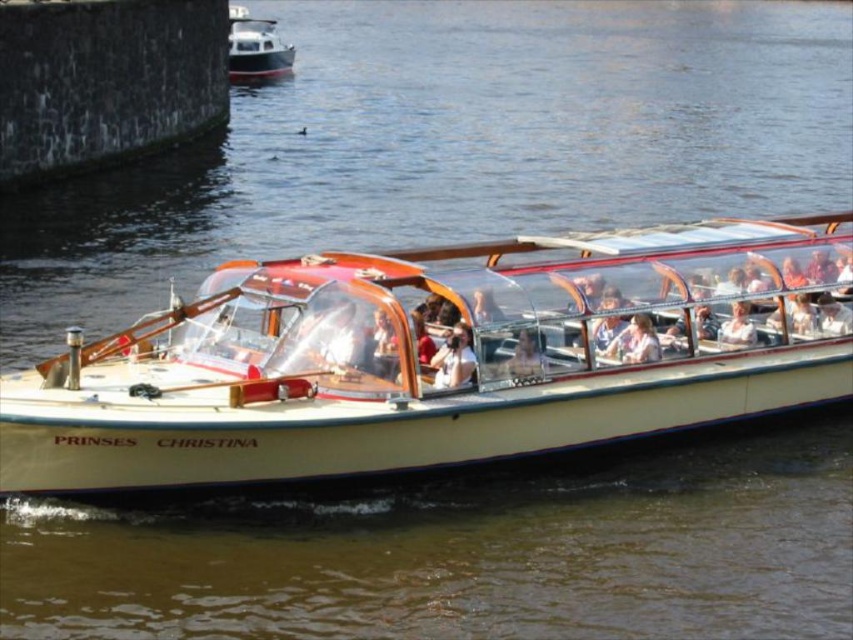
Is point (283, 51) farther from camera compared to point (627, 332)?

Yes, point (283, 51) is farther from viewer.

Is white glossy boat at upper left positioned at the back of light brown leather jacket at center?

Yes, white glossy boat at upper left is further from the viewer.

Is point (259, 58) positioned behind point (634, 316)?

Yes, point (259, 58) is behind point (634, 316).

Where is `white glossy boat at upper left`? The image size is (853, 640). white glossy boat at upper left is located at coordinates (254, 48).

From the picture: Can you confirm if light beige wood boat at center is taller than light beige fabric jacket at center?

Indeed, light beige wood boat at center has a greater height compared to light beige fabric jacket at center.

Can you confirm if light beige wood boat at center is positioned above light beige fabric jacket at center?

No.

The image size is (853, 640). What do you see at coordinates (454, 358) in the screenshot? I see `light beige wood boat at center` at bounding box center [454, 358].

Find the location of a particular element. The image size is (853, 640). light beige wood boat at center is located at coordinates (454, 358).

Between point (840, 349) and point (433, 358), which one is positioned behind?

Positioned behind is point (840, 349).

Who is taller, white polished wood boat at center or light beige wood boat at center?

white polished wood boat at center is taller.

Where is `white polished wood boat at center`? white polished wood boat at center is located at coordinates (427, 362).

Find the location of `white polished wood boat at center`. white polished wood boat at center is located at coordinates (427, 362).